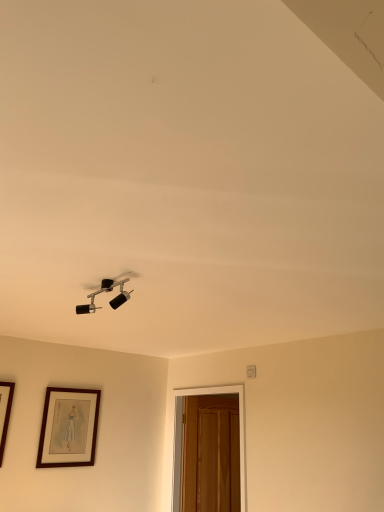
Question: Is wooden door at lower right positioned in front of matte black light fixture at upper center?

Choices:
 (A) no
 (B) yes

Answer: (A)

Question: From a real-world perspective, does wooden door at lower right sit lower than matte black light fixture at upper center?

Choices:
 (A) no
 (B) yes

Answer: (B)

Question: From the image's perspective, is wooden door at lower right located beneath matte black light fixture at upper center?

Choices:
 (A) yes
 (B) no

Answer: (A)

Question: Is wooden door at lower right at the left side of matte black light fixture at upper center?

Choices:
 (A) no
 (B) yes

Answer: (A)

Question: Are wooden door at lower right and matte black light fixture at upper center making contact?

Choices:
 (A) no
 (B) yes

Answer: (A)

Question: Would you say brown wooden picture frame at lower left is to the left or to the right of matte black light fixture at upper center in the picture?

Choices:
 (A) right
 (B) left

Answer: (B)

Question: Considering the positions of point (79, 446) and point (97, 307), is point (79, 446) closer or farther from the camera than point (97, 307)?

Choices:
 (A) closer
 (B) farther

Answer: (B)

Question: From the image's perspective, is brown wooden picture frame at lower left positioned above or below matte black light fixture at upper center?

Choices:
 (A) above
 (B) below

Answer: (B)

Question: Is brown wooden picture frame at lower left inside the boundaries of matte black light fixture at upper center, or outside?

Choices:
 (A) outside
 (B) inside

Answer: (A)

Question: In terms of width, does wooden door at lower right look wider or thinner when compared to matte black light fixture at upper center?

Choices:
 (A) thin
 (B) wide

Answer: (A)

Question: Is wooden door at lower right bigger or smaller than matte black light fixture at upper center?

Choices:
 (A) small
 (B) big

Answer: (B)

Question: Considering the positions of wooden door at lower right and matte black light fixture at upper center in the image, is wooden door at lower right taller or shorter than matte black light fixture at upper center?

Choices:
 (A) tall
 (B) short

Answer: (A)

Question: From a real-world perspective, is wooden door at lower right positioned above or below matte black light fixture at upper center?

Choices:
 (A) above
 (B) below

Answer: (B)

Question: In the image, is brown wooden picture frame at lower left positioned in front of or behind wooden door at lower right?

Choices:
 (A) behind
 (B) front

Answer: (A)

Question: From the image's perspective, is brown wooden picture frame at lower left positioned above or below wooden door at lower right?

Choices:
 (A) above
 (B) below

Answer: (A)